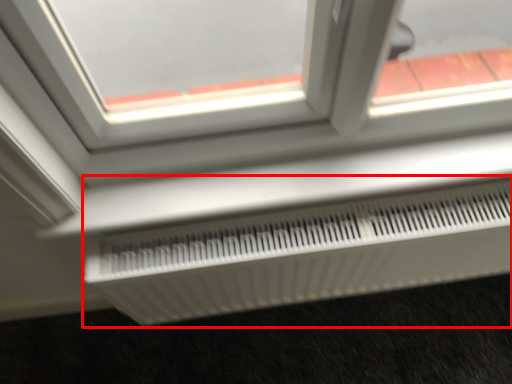
Question: From the image's perspective, what is the correct spatial relationship of air conditioning (annotated by the red box) in relation to window?

Choices:
 (A) above
 (B) below

Answer: (B)